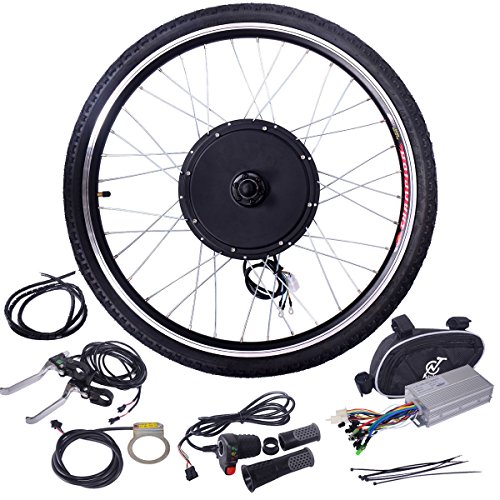
Where is `cords and wires`? The image size is (500, 500). cords and wires is located at coordinates (277, 290), (61, 322), (107, 355), (233, 417), (362, 426).